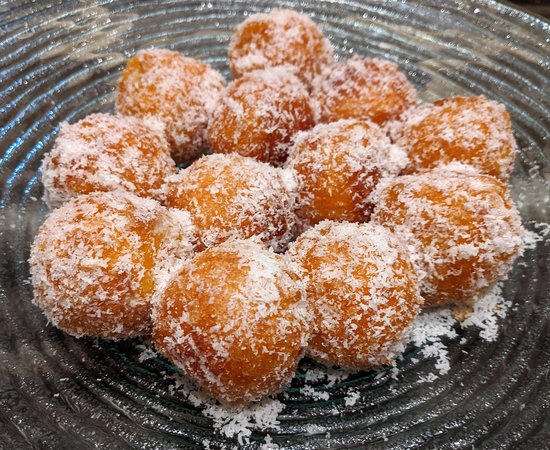
The height and width of the screenshot is (450, 550). Find the location of `plate`. plate is located at coordinates (440, 412).